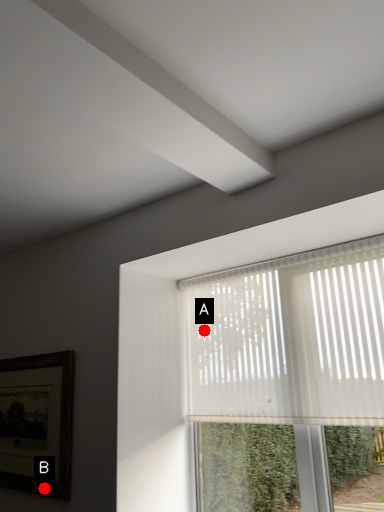
Question: Two points are circled on the image, labeled by A and B beside each circle. Which point appears closest to the camera in this image?

Choices:
 (A) A is closer
 (B) B is closer

Answer: (B)